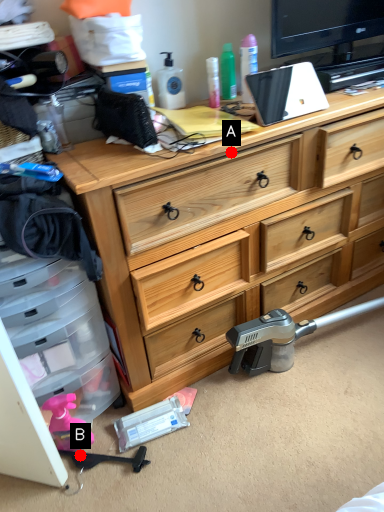
Question: Two points are circled on the image, labeled by A and B beside each circle. Which of the following is the farthest from the observer?

Choices:
 (A) A is further
 (B) B is further

Answer: (B)